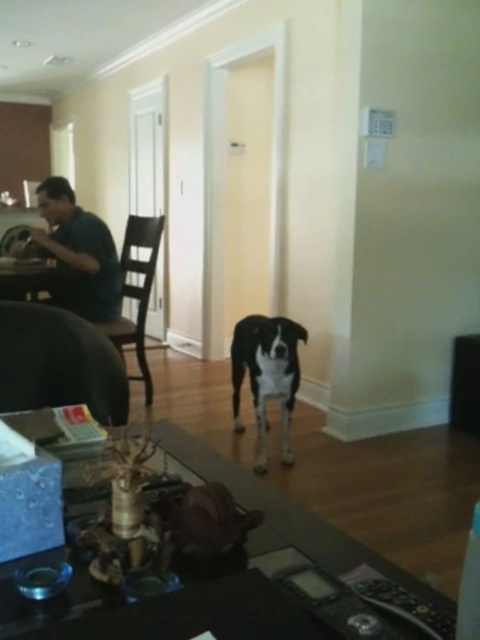
Between point (204, 456) and point (144, 268), which one is positioned behind?

Point (144, 268)

Which is more to the left, black glass table at center or brown wooden chair at left?

brown wooden chair at left

Does point (129, 625) lie behind point (129, 332)?

No, it is not.

Locate an element on the screen. The width and height of the screenshot is (480, 640). black glass table at center is located at coordinates (244, 579).

Who is positioned more to the left, dark blue shirt at left or brown wooden chair at left?

Positioned to the left is dark blue shirt at left.

Is dark blue shirt at left below brown wooden chair at left?

Actually, dark blue shirt at left is above brown wooden chair at left.

Where is `dark blue shirt at left`? This screenshot has height=640, width=480. dark blue shirt at left is located at coordinates (79, 252).

Find the location of a particular element. The width and height of the screenshot is (480, 640). dark blue shirt at left is located at coordinates (79, 252).

Between brown wooden chair at left and black glossy table at lower left, which one has less height?

black glossy table at lower left is shorter.

Does brown wooden chair at left have a greater height compared to black glossy table at lower left?

Yes, brown wooden chair at left is taller than black glossy table at lower left.

Is point (135, 376) behind point (57, 269)?

Yes, point (135, 376) is behind point (57, 269).

Locate an element on the screen. The image size is (480, 640). brown wooden chair at left is located at coordinates (136, 291).